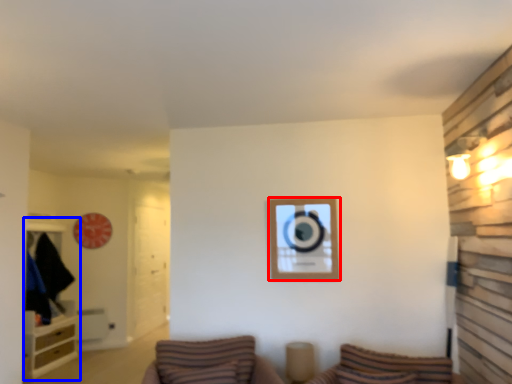
Question: Which point is further to the camera, picture frame (highlighted by a red box) or entertainment center (highlighted by a blue box)?

Choices:
 (A) picture frame
 (B) entertainment center

Answer: (B)